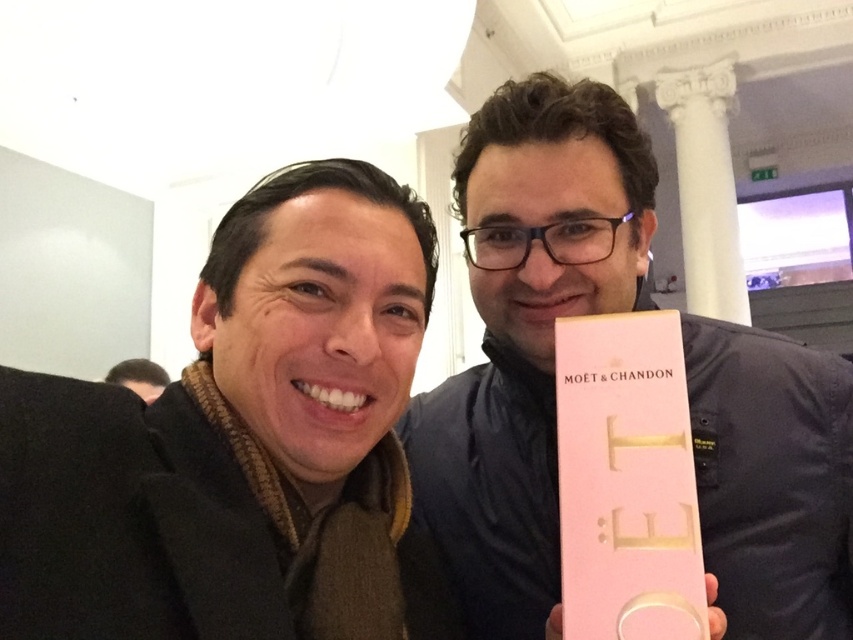
Is the position of pink matte box at right more distant than that of brown hair at upper left?

No, it is in front of brown hair at upper left.

Can you confirm if pink matte box at right is thinner than brown hair at upper left?

No, pink matte box at right is not thinner than brown hair at upper left.

Consider the image. Who is more forward, (434,465) or (149,390)?

Point (434,465) is in front.

Find the location of `pink matte box at right`. pink matte box at right is located at coordinates (526, 332).